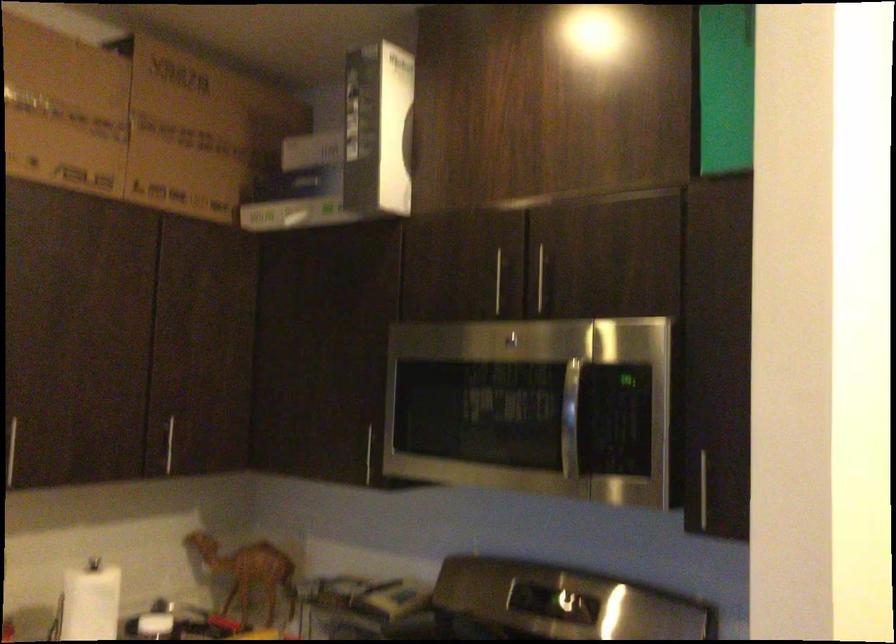
Where is `microwave door handle`? microwave door handle is located at coordinates (570, 420).